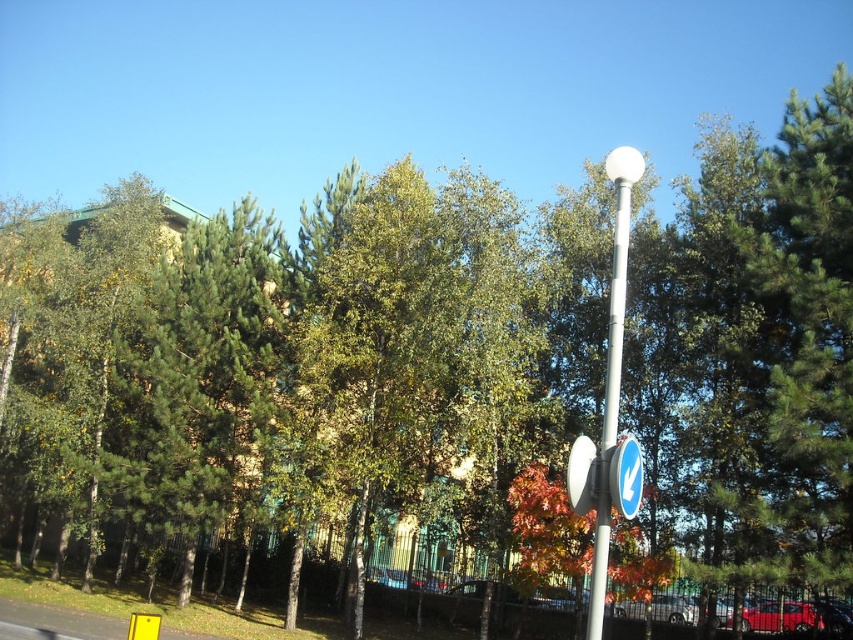
Does point (602, 472) lie behind point (572, 449)?

No, (602, 472) is closer to viewer.

Between point (624, 156) and point (572, 509), which one is positioned behind?

Point (572, 509)

Is point (610, 429) positioned behind point (573, 458)?

No.

At what (x,y) coordinates should I click in order to perform the action: click on white glossy lamp post at upper right. Please return your answer as a coordinate pair (x, y). Looking at the image, I should click on (611, 369).

Between blue glossy traffic sign at center right and white glossy traffic sign at center-right, which one has more height?

blue glossy traffic sign at center right

Is blue glossy traffic sign at center right above white glossy traffic sign at center-right?

Incorrect, blue glossy traffic sign at center right is not positioned above white glossy traffic sign at center-right.

Which is in front, point (631, 515) or point (577, 481)?

Positioned in front is point (631, 515).

Find the location of a particular element. The height and width of the screenshot is (640, 853). blue glossy traffic sign at center right is located at coordinates (625, 476).

Does blue glossy traffic sign at center right come behind blue glossy traffic sign at upper center?

Yes.

Is blue glossy traffic sign at center right smaller than blue glossy traffic sign at upper center?

No.

Find the location of a particular element. The height and width of the screenshot is (640, 853). blue glossy traffic sign at center right is located at coordinates (625, 476).